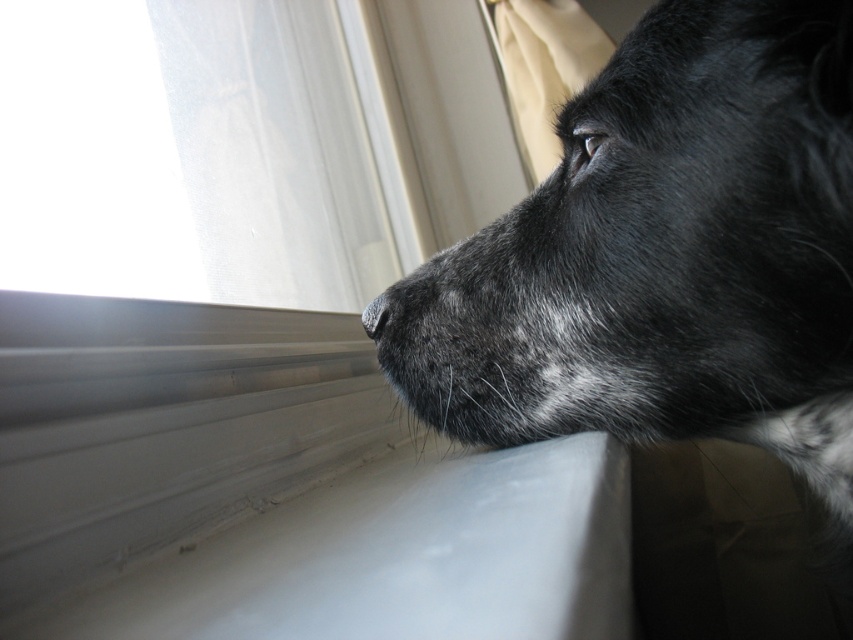
You are a photographer trying to capture the black fur dog at upper right in the center of your photo. Based on its current position at point 0.400, 0.781, should you move the camera to the left or right to center the dog?

The black fur dog at upper right is located at point (665,256). To center it, you should move the camera to the left since the dog is positioned to the right side of the frame.

You are a photographer trying to capture the dog in the image. The dog is positioned at point (665,256). To ensure the dog is centered in your photo, should you move the camera to the left or right? Please explain your reasoning based on the dog position.

The black fur dog at upper right is located at point (665,256). Since the dog is at the upper right of the image, moving the camera to the left would bring the dog closer to the center. However, without knowing the exact center coordinates, it is difficult to determine the exact direction. But based on the position, moving left might help center the dog.